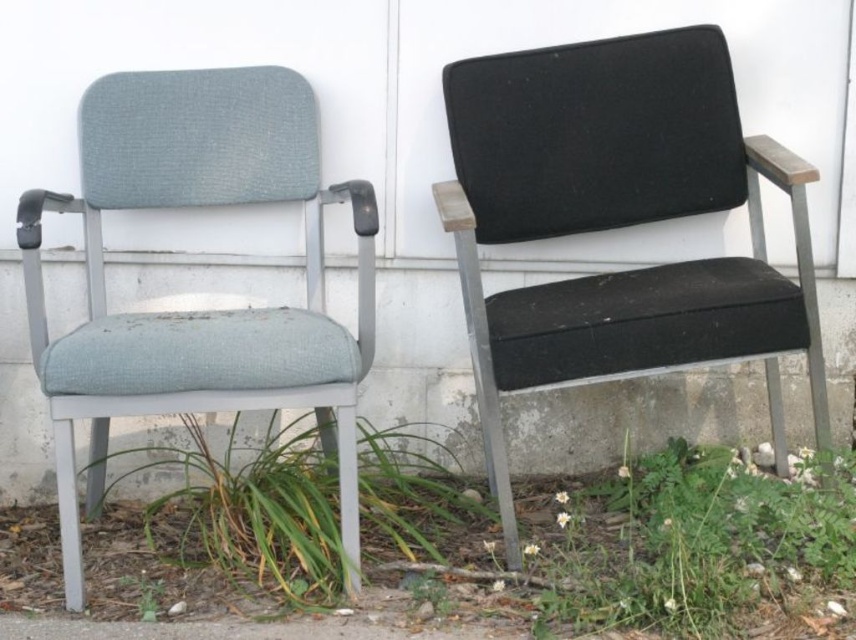
Question: Among these points, which one is farthest from the camera?

Choices:
 (A) (688, 282)
 (B) (138, 324)

Answer: (A)

Question: Does black fabric chair at right appear on the right side of green leafy grass at lower center?

Choices:
 (A) no
 (B) yes

Answer: (B)

Question: Estimate the real-world distances between objects in this image. Which object is farther from the green leafy grass at lower center?

Choices:
 (A) matte gray fabric chair at left
 (B) black fabric chair at right

Answer: (B)

Question: Is black fabric chair at right bigger than matte gray fabric chair at left?

Choices:
 (A) no
 (B) yes

Answer: (A)

Question: Considering the relative positions of black fabric chair at right and green leafy grass at lower center in the image provided, where is black fabric chair at right located with respect to green leafy grass at lower center?

Choices:
 (A) above
 (B) below

Answer: (A)

Question: Which point is closer to the camera?

Choices:
 (A) (x=535, y=220)
 (B) (x=355, y=372)

Answer: (B)